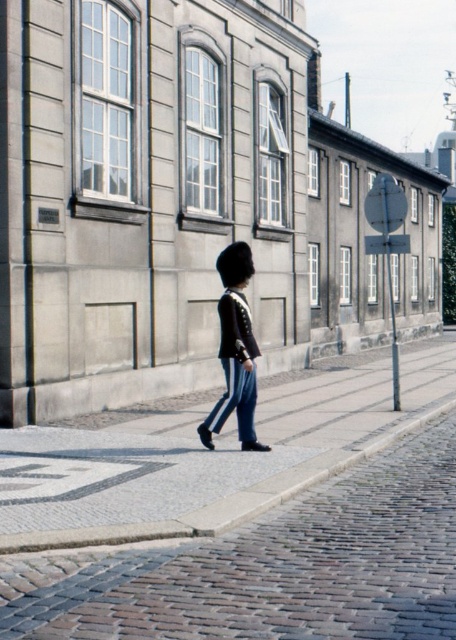
Between point (413, 477) and point (247, 276), which one is positioned in front?

Positioned in front is point (413, 477).

Does cobblestone pavement at center appear under shiny black uniform at center?

Correct, cobblestone pavement at center is located below shiny black uniform at center.

You are a GUI agent. You are given a task and a screenshot of the screen. Output one action in this format:
    pyautogui.click(x=<x>, y=<y>)
    Task: Click on the cobblestone pavement at center
    
    Given the screenshot: What is the action you would take?
    pyautogui.click(x=243, y=515)